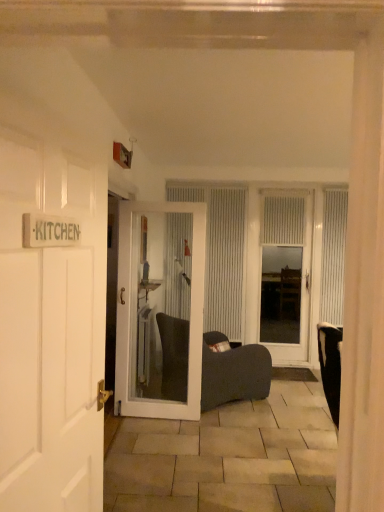
Image resolution: width=384 pixels, height=512 pixels. Find the location of `vacant space underneath white glossy door at center, placed as the second door when sorted from right to left (from a real-world perspective)`. vacant space underneath white glossy door at center, placed as the second door when sorted from right to left (from a real-world perspective) is located at coordinates (153, 416).